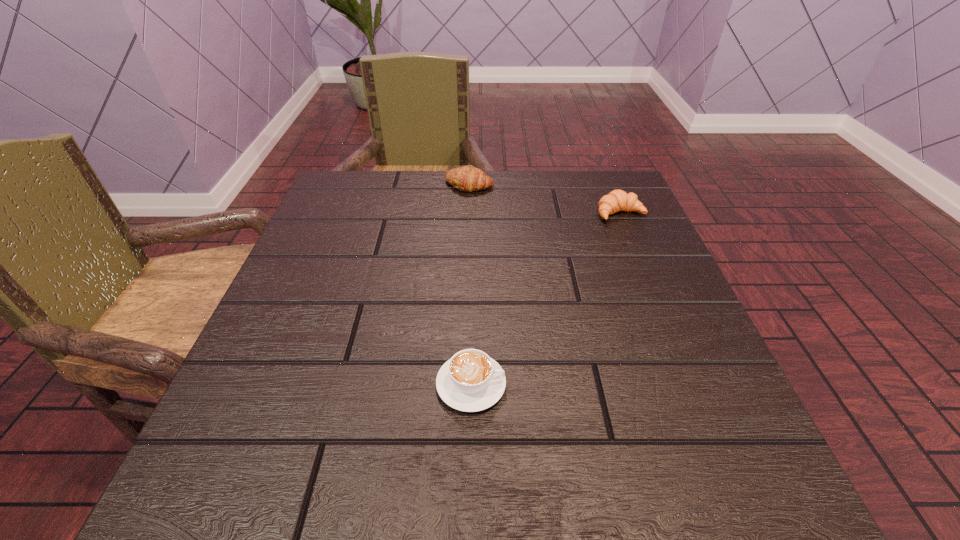
Where is `the farthest object`? The height and width of the screenshot is (540, 960). the farthest object is located at coordinates (468, 178).

The width and height of the screenshot is (960, 540). What are the coordinates of `the farther crescent roll` in the screenshot? It's located at (468, 178).

Identify the location of the second nearest object. Image resolution: width=960 pixels, height=540 pixels. (617, 200).

This screenshot has height=540, width=960. Find the location of `the nearer crescent roll`. the nearer crescent roll is located at coordinates (617, 200).

Identify the location of the nearest object. (471, 381).

Identify the location of blank space located on the front of the farther crescent roll. (466, 300).

Where is `vacant region located 0.240m on the front of the right crescent roll`? Image resolution: width=960 pixels, height=540 pixels. vacant region located 0.240m on the front of the right crescent roll is located at coordinates (658, 303).

Where is `free space located 0.150m on the side of the cappuccino with the handle`? This screenshot has width=960, height=540. free space located 0.150m on the side of the cappuccino with the handle is located at coordinates (606, 384).

The image size is (960, 540). Identify the location of object that is at the right edge. (617, 200).

You are a GUI agent. You are given a task and a screenshot of the screen. Output one action in this format:
    pyautogui.click(x=<x>, y=<y>)
    Task: Click on the object positioned at the far right corner
    The width and height of the screenshot is (960, 540).
    Given the screenshot: What is the action you would take?
    pyautogui.click(x=617, y=200)